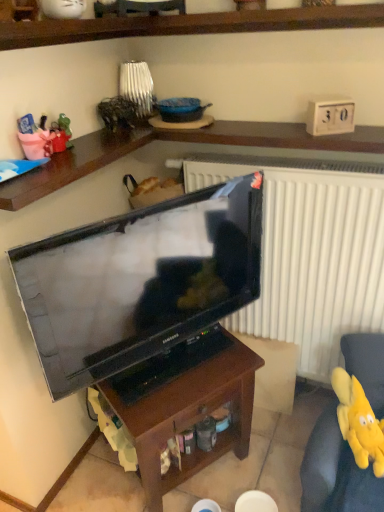
Question: Is matte black television at center surrounded by brown wood table at center?

Choices:
 (A) yes
 (B) no

Answer: (B)

Question: Does brown wood table at center appear on the left side of matte black television at center?

Choices:
 (A) yes
 (B) no

Answer: (B)

Question: Considering the relative sizes of brown wood table at center and matte black television at center in the image provided, is brown wood table at center smaller than matte black television at center?

Choices:
 (A) yes
 (B) no

Answer: (B)

Question: Is matte black television at center at the back of brown wood table at center?

Choices:
 (A) no
 (B) yes

Answer: (A)

Question: Is brown wood table at center outside of matte black television at center?

Choices:
 (A) no
 (B) yes

Answer: (B)

Question: Is brown wood table at center situated inside yellow plush toy at lower right or outside?

Choices:
 (A) inside
 (B) outside

Answer: (B)

Question: Is brown wood table at center in front of or behind yellow plush toy at lower right in the image?

Choices:
 (A) behind
 (B) front

Answer: (B)

Question: Considering the positions of brown wood table at center and yellow plush toy at lower right in the image, is brown wood table at center taller or shorter than yellow plush toy at lower right?

Choices:
 (A) short
 (B) tall

Answer: (B)

Question: From a real-world perspective, relative to yellow plush toy at lower right, is brown wood table at center vertically above or below?

Choices:
 (A) above
 (B) below

Answer: (B)

Question: From a real-world perspective, is yellow plush toy at lower right above or below matte black television at center?

Choices:
 (A) below
 (B) above

Answer: (A)

Question: Considering the positions of yellow plush toy at lower right and matte black television at center in the image, is yellow plush toy at lower right taller or shorter than matte black television at center?

Choices:
 (A) short
 (B) tall

Answer: (A)

Question: From the image's perspective, is yellow plush toy at lower right located above or below matte black television at center?

Choices:
 (A) below
 (B) above

Answer: (A)

Question: Considering their positions, is yellow plush toy at lower right located in front of or behind matte black television at center?

Choices:
 (A) front
 (B) behind

Answer: (B)

Question: Considering their positions, is matte black television at center located in front of or behind yellow plush toy at lower right?

Choices:
 (A) behind
 (B) front

Answer: (B)

Question: Is matte black television at center taller or shorter than yellow plush toy at lower right?

Choices:
 (A) tall
 (B) short

Answer: (A)